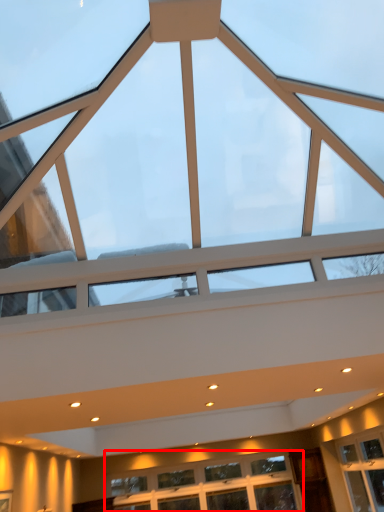
Question: From the image's perspective, considering the relative positions of window (annotated by the red box) and window in the image provided, where is window (annotated by the red box) located with respect to the staircase?

Choices:
 (A) above
 (B) below

Answer: (B)